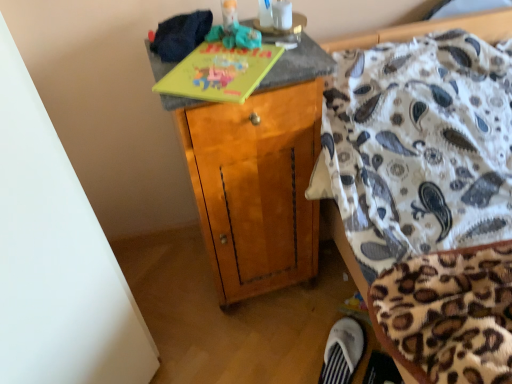
Find the location of a particular element. vacant space to the right of rubberized green toy at upper center is located at coordinates (287, 45).